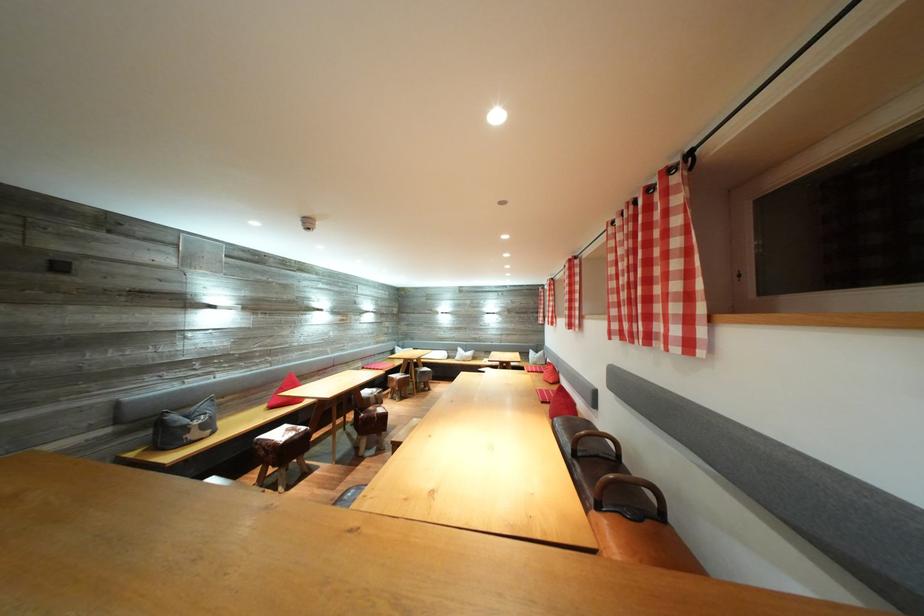
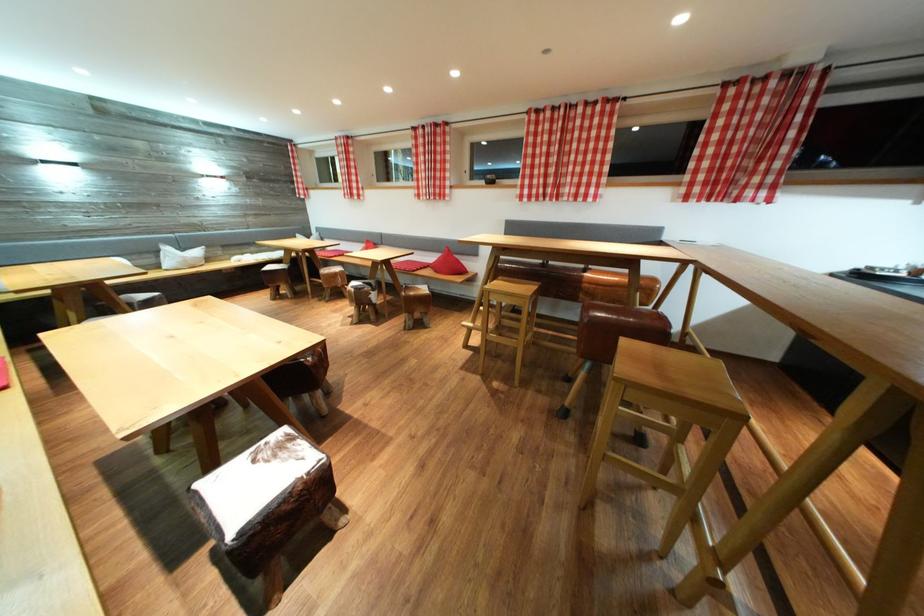
The point at (299, 435) is marked in the first image. Where is the corresponding point in the second image?

(286, 452)